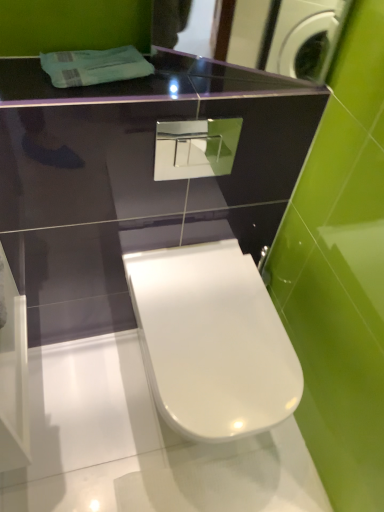
Image resolution: width=384 pixels, height=512 pixels. What do you see at coordinates (257, 32) in the screenshot?
I see `glossy black mirror at upper center` at bounding box center [257, 32].

Where is `glossy black mirror at upper center`? Image resolution: width=384 pixels, height=512 pixels. glossy black mirror at upper center is located at coordinates (257, 32).

In order to face glossy black mirror at upper center, should I rotate leftwards or rightwards?

A 7.940 degree turn to the right will do.

Where is `white glossy toilet at center`? This screenshot has width=384, height=512. white glossy toilet at center is located at coordinates (212, 341).

Describe the element at coordinates (212, 341) in the screenshot. The height and width of the screenshot is (512, 384). I see `white glossy toilet at center` at that location.

From the picture: In order to face white glossy toilet at center, should I rotate leftwards or rightwards?

Turn right approximately 1.873 degrees to face it.

Image resolution: width=384 pixels, height=512 pixels. I want to click on glossy black mirror at upper center, so click(257, 32).

Would you say white glossy toilet at center is to the left or to the right of glossy black mirror at upper center in the picture?

Clearly, white glossy toilet at center is on the left of glossy black mirror at upper center in the image.

Relative to glossy black mirror at upper center, is white glossy toilet at center in front or behind?

white glossy toilet at center is positioned farther from the viewer than glossy black mirror at upper center.

Which is closer, (x=176, y=429) or (x=283, y=17)?

Point (x=176, y=429) is positioned closer to the camera compared to point (x=283, y=17).

Consider the image. From the image's perspective, is white glossy toilet at center on glossy black mirror at upper center?

No.

From a real-world perspective, who is located higher, white glossy toilet at center or glossy black mirror at upper center?

From a 3D spatial view, glossy black mirror at upper center is above.

Considering the sizes of objects white glossy toilet at center and glossy black mirror at upper center in the image provided, who is wider, white glossy toilet at center or glossy black mirror at upper center?

white glossy toilet at center is wider.

In terms of height, does white glossy toilet at center look taller or shorter compared to glossy black mirror at upper center?

Considering their sizes, white glossy toilet at center has more height than glossy black mirror at upper center.

Who is bigger, white glossy toilet at center or glossy black mirror at upper center?

white glossy toilet at center.

Would you say white glossy toilet at center is outside glossy black mirror at upper center?

white glossy toilet at center lies outside glossy black mirror at upper center's area.

Is the surface of white glossy toilet at center in direct contact with glossy black mirror at upper center?

No, white glossy toilet at center is not touching glossy black mirror at upper center.

Is white glossy toilet at center oriented away from glossy black mirror at upper center?

No, glossy black mirror at upper center is not at the back of white glossy toilet at center.

The width and height of the screenshot is (384, 512). In order to click on toilet that is under the glossy black mirror at upper center (from a real-world perspective) in this screenshot , I will do `click(212, 341)`.

Considering the relative positions of glossy black mirror at upper center and white glossy toilet at center in the image provided, is glossy black mirror at upper center to the right of white glossy toilet at center from the viewer's perspective?

Indeed, glossy black mirror at upper center is positioned on the right side of white glossy toilet at center.

Who is more distant, glossy black mirror at upper center or white glossy toilet at center?

white glossy toilet at center is behind.

Which is nearer, (282, 41) or (190, 394)?

The point (190, 394) is in front.

From the picture: From the image's perspective, is glossy black mirror at upper center beneath white glossy toilet at center?

Actually, glossy black mirror at upper center appears above white glossy toilet at center in the image.

From a real-world perspective, which is physically below, glossy black mirror at upper center or white glossy toilet at center?

white glossy toilet at center.

Considering the relative sizes of glossy black mirror at upper center and white glossy toilet at center in the image provided, is glossy black mirror at upper center wider than white glossy toilet at center?

In fact, glossy black mirror at upper center might be narrower than white glossy toilet at center.

Which of these two, glossy black mirror at upper center or white glossy toilet at center, stands shorter?

Standing shorter between the two is glossy black mirror at upper center.

Considering the sizes of objects glossy black mirror at upper center and white glossy toilet at center in the image provided, who is smaller, glossy black mirror at upper center or white glossy toilet at center?

glossy black mirror at upper center is smaller.

Is glossy black mirror at upper center not inside white glossy toilet at center?

Yes, glossy black mirror at upper center is located beyond the bounds of white glossy toilet at center.

Is glossy black mirror at upper center far away from white glossy toilet at center?

That's right, there is a large distance between glossy black mirror at upper center and white glossy toilet at center.

Is glossy black mirror at upper center oriented towards white glossy toilet at center?

No, glossy black mirror at upper center is not oriented towards white glossy toilet at center.

How many degrees apart are the facing directions of glossy black mirror at upper center and white glossy toilet at center?

There is a 23.5-degree angle between the facing directions of glossy black mirror at upper center and white glossy toilet at center.

In order to click on toilet located underneath the glossy black mirror at upper center (from a real-world perspective) in this screenshot , I will do `click(212, 341)`.

Find the location of `toilet lying below the glossy black mirror at upper center (from the image's perspective)`. toilet lying below the glossy black mirror at upper center (from the image's perspective) is located at coordinates (212, 341).

Find the location of a particular element. The height and width of the screenshot is (512, 384). mirror lying on the right of white glossy toilet at center is located at coordinates (257, 32).